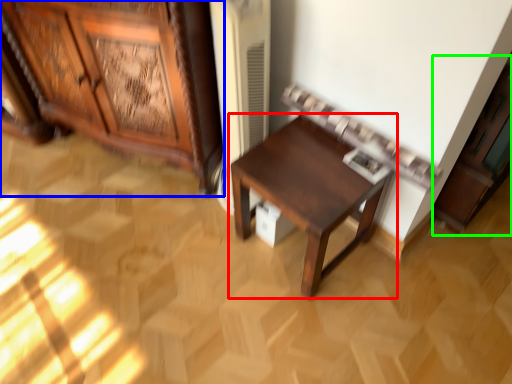
Question: Which object is positioned farthest from table (highlighted by a red box)? Select from cabinetry (highlighted by a blue box) and cabinetry (highlighted by a green box).

Choices:
 (A) cabinetry
 (B) cabinetry

Answer: (A)